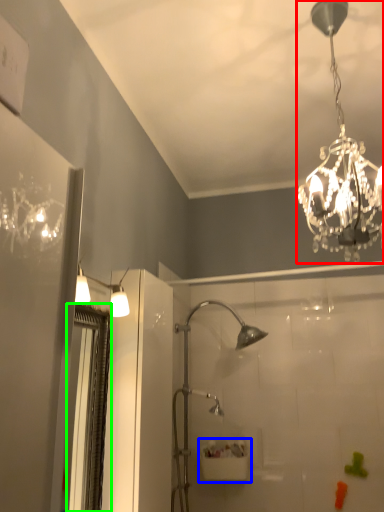
Question: Which object is positioned closest to lamp (highlighted by a red box)? Select from sink (highlighted by a blue box) and screen door (highlighted by a green box).

Choices:
 (A) sink
 (B) screen door

Answer: (B)